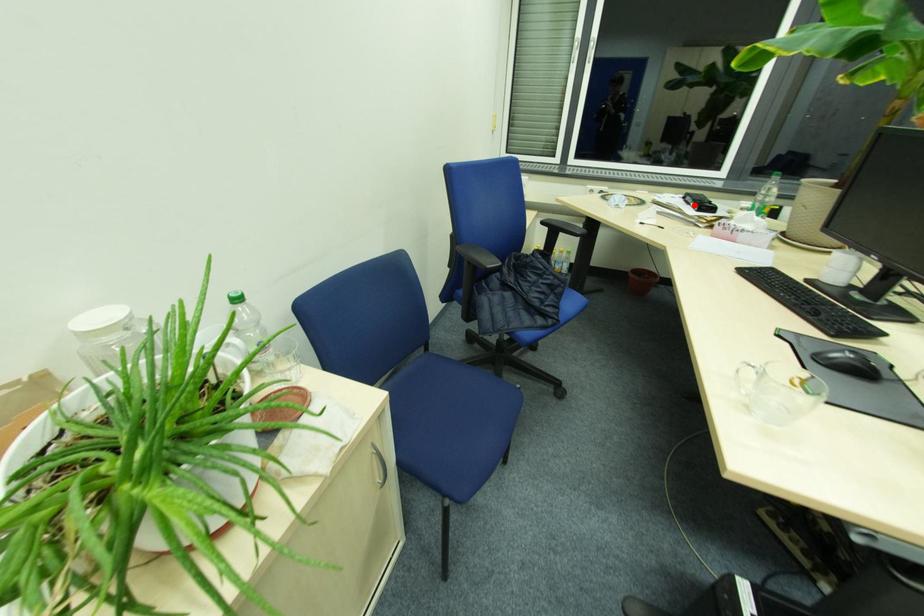
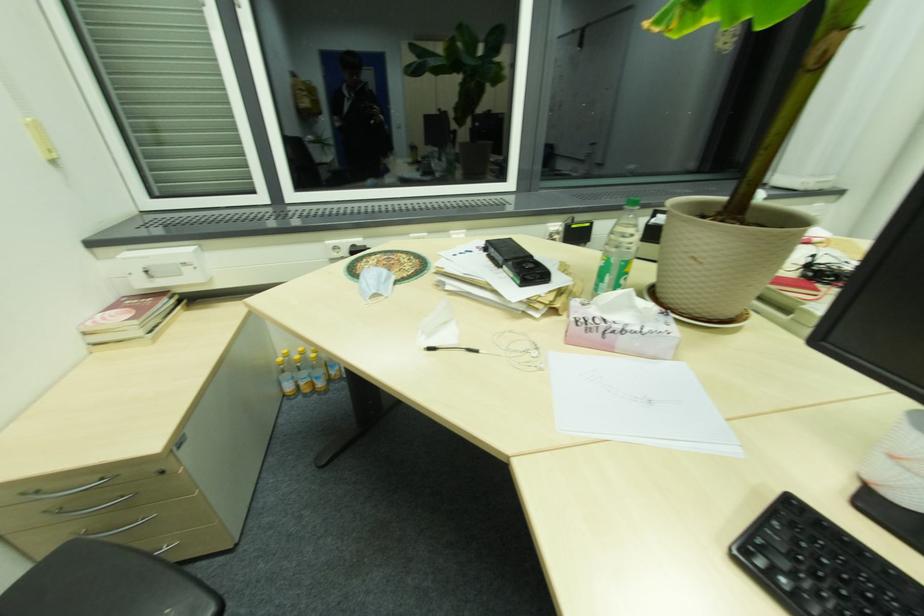
In the second image, find the point that corresponds to the highlighted location in the first image.

(504, 268)